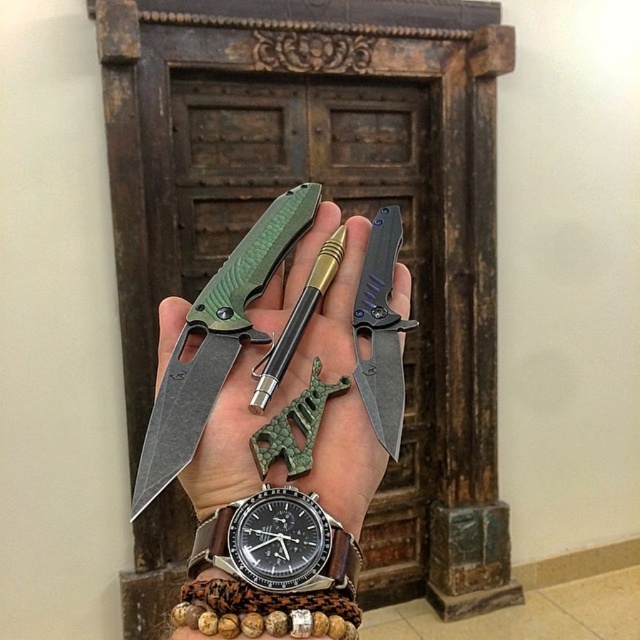
Does matte black knife at center have a lesser height compared to black leather watch at center?

No, matte black knife at center is not shorter than black leather watch at center.

Which is above, matte black knife at center or black leather watch at center?

matte black knife at center is above.

Who is more forward, (211, 483) or (253, 554)?

Positioned in front is point (253, 554).

Find the location of `matte black knife at center`. matte black knife at center is located at coordinates (289, 403).

Which is behind, point (212, 392) or point (376, 252)?

The point (376, 252) is more distant.

Is green textured knife at center bigger than dark gray matte knife at center?

Correct, green textured knife at center is larger in size than dark gray matte knife at center.

Which is in front, point (156, 436) or point (371, 324)?

Positioned in front is point (156, 436).

The width and height of the screenshot is (640, 640). What are the coordinates of `green textured knife at center` in the screenshot? It's located at (216, 340).

How far apart are matte black knife at center and dark gray matte knife at center?

A distance of 2.04 inches exists between matte black knife at center and dark gray matte knife at center.

Who is positioned more to the right, matte black knife at center or dark gray matte knife at center?

Positioned to the right is dark gray matte knife at center.

Is point (352, 300) in front of point (369, 259)?

Yes.

Identify the location of matte black knife at center. (289, 403).